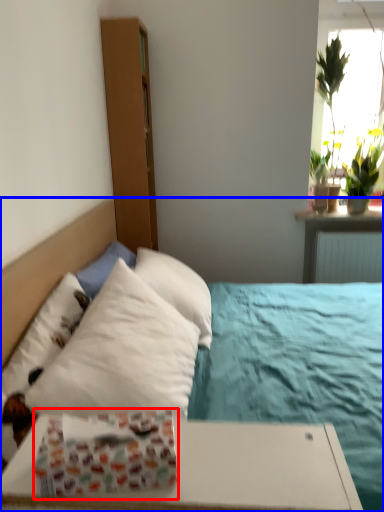
Question: Which point is further to the camera, gift wrap (highlighted by a red box) or bed (highlighted by a blue box)?

Choices:
 (A) gift wrap
 (B) bed

Answer: (B)